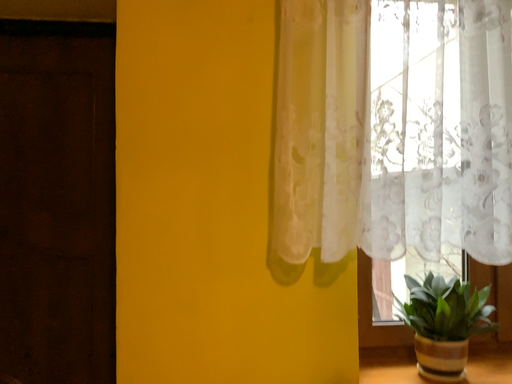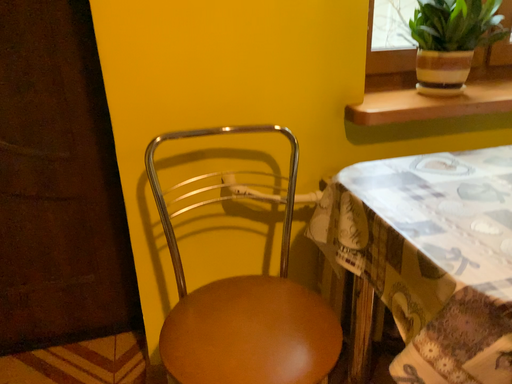
Question: How did the camera likely rotate when shooting the video?

Choices:
 (A) rotated downward
 (B) rotated upward

Answer: (A)